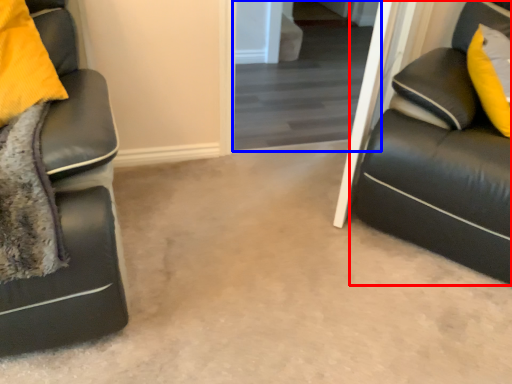
Question: Which object is further to the camera taking this photo, studio couch (highlighted by a red box) or glass door (highlighted by a blue box)?

Choices:
 (A) studio couch
 (B) glass door

Answer: (B)